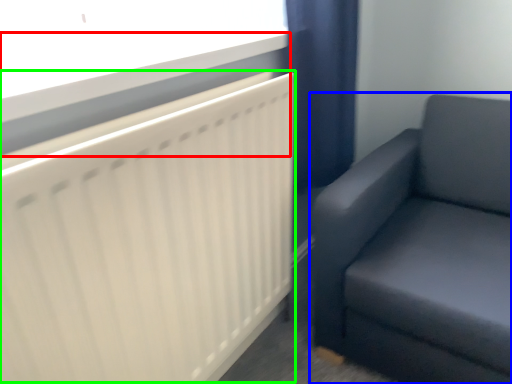
Question: Which is farther away from window sill (highlighted by a red box)? studio couch (highlighted by a blue box) or radiator (highlighted by a green box)?

Choices:
 (A) studio couch
 (B) radiator

Answer: (A)